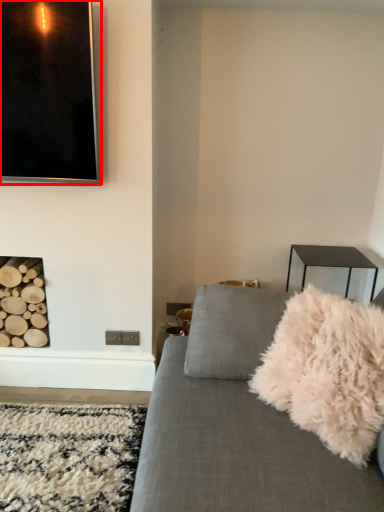
Question: Considering the relative positions of picture frame (annotated by the red box) and throw pillow in the image provided, where is picture frame (annotated by the red box) located with respect to the staircase?

Choices:
 (A) left
 (B) right

Answer: (A)